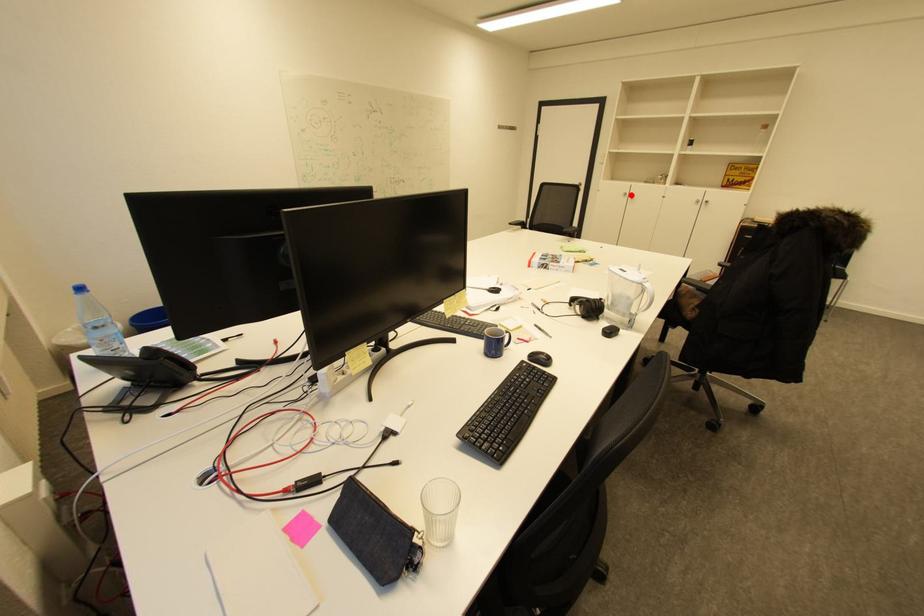
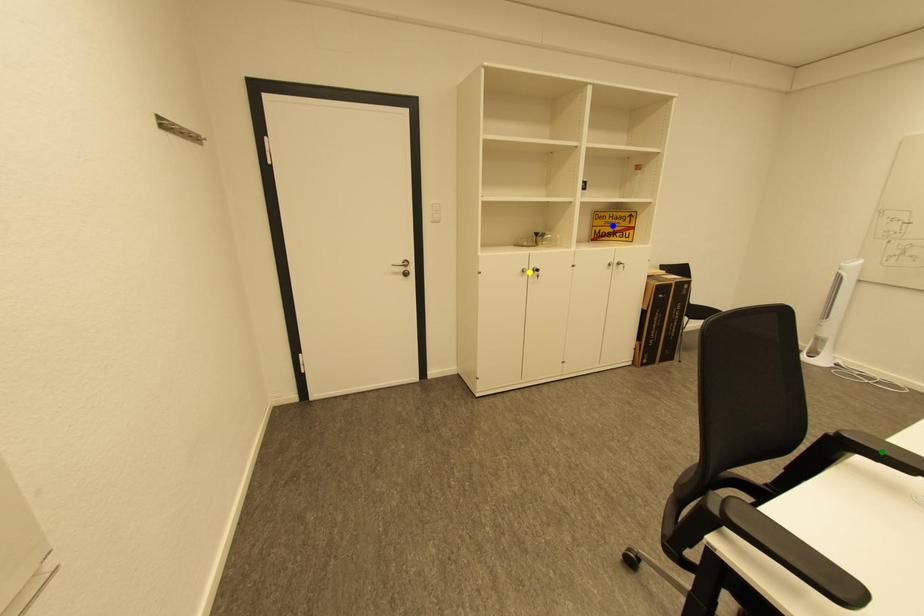
Question: I am providing you with two images of the same scene from different viewpoints. A red point is marked on the first image. You are given multiple points on the second image. In image 2, which mark is for the same physical point as the one in image 1?

Choices:
 (A) yellow point
 (B) blue point
 (C) green point

Answer: (A)